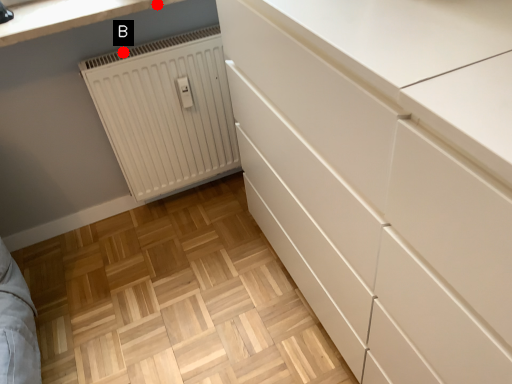
Question: Two points are circled on the image, labeled by A and B beside each circle. Which of the following is the farthest from the observer?

Choices:
 (A) A is further
 (B) B is further

Answer: (B)